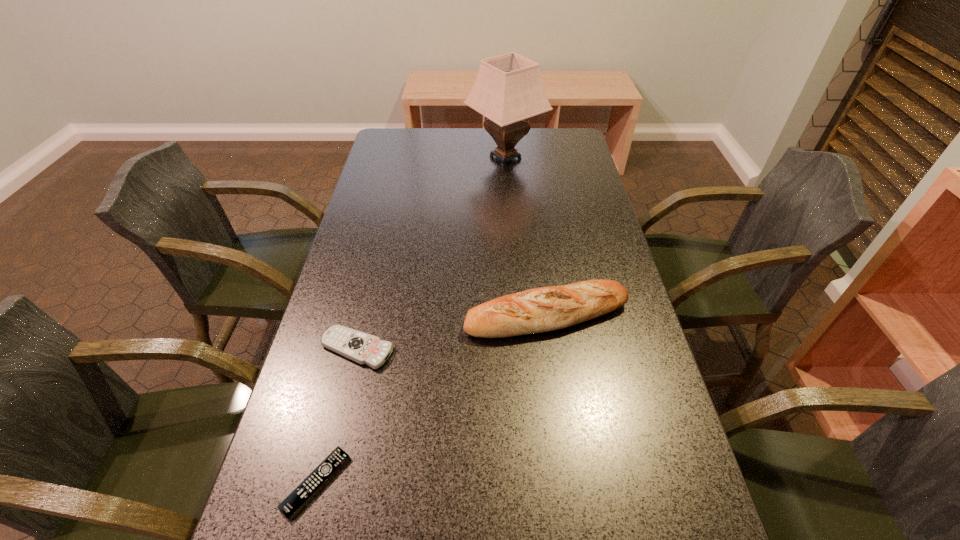
Locate an element on the screen. This screenshot has height=540, width=960. the third closest object to the third shortest object is located at coordinates (508, 89).

Select which object appears as the closest to the nearest object. Please provide its 2D coordinates. Your answer should be formatted as a tuple, i.e. [(x, y)], where the tuple contains the x and y coordinates of a point satisfying the conditions above.

[(363, 348)]

What are the coordinates of `vacant space that satisfies the following two spatial constraints: 1. on the back side of the farther remote control; 2. on the right side of the baguet` in the screenshot? It's located at (365, 315).